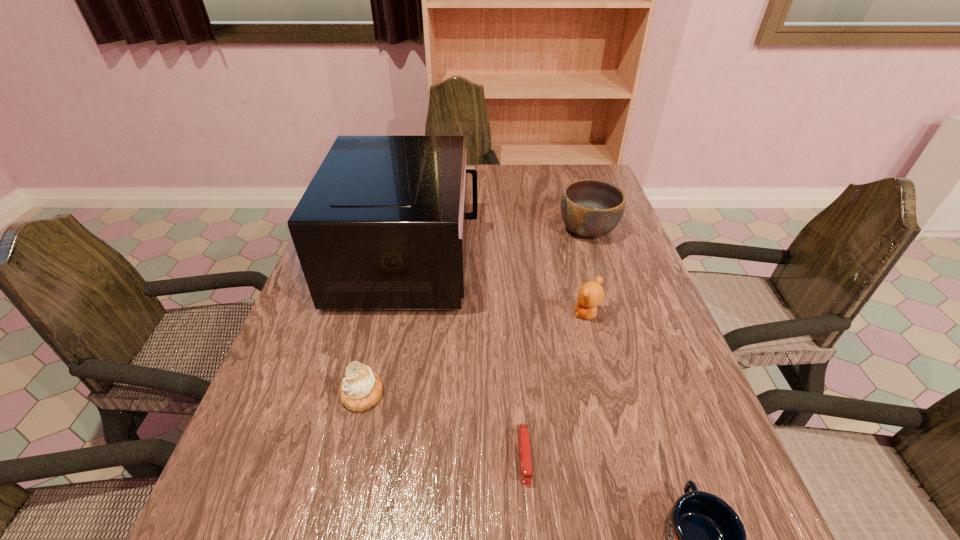
Find the location of a particular element. The width and height of the screenshot is (960, 540). vacant area situated 0.150m on the face of the teddy bear is located at coordinates pos(510,314).

Image resolution: width=960 pixels, height=540 pixels. Find the location of `free space located 0.370m on the face of the teddy bear`. free space located 0.370m on the face of the teddy bear is located at coordinates (415, 314).

The width and height of the screenshot is (960, 540). I want to click on vacant area situated 0.120m on the front of the third nearest object, so click(343, 477).

Where is `microwave_oven at the left edge`? microwave_oven at the left edge is located at coordinates coord(382,225).

The width and height of the screenshot is (960, 540). What are the coordinates of `pastry located in the left edge section of the desktop` in the screenshot? It's located at [x=361, y=388].

Locate an element on the screen. The image size is (960, 540). bowl that is positioned at the right edge is located at coordinates (591, 208).

This screenshot has width=960, height=540. In order to click on teddy bear that is at the right edge in this screenshot , I will do `click(591, 294)`.

This screenshot has width=960, height=540. Identify the location of vacant point at the far edge. (538, 177).

Where is `vacant point at the left edge`? The width and height of the screenshot is (960, 540). vacant point at the left edge is located at coordinates (292, 342).

In the image, there is a desktop. Where is `free space at the right edge`? The image size is (960, 540). free space at the right edge is located at coordinates (719, 451).